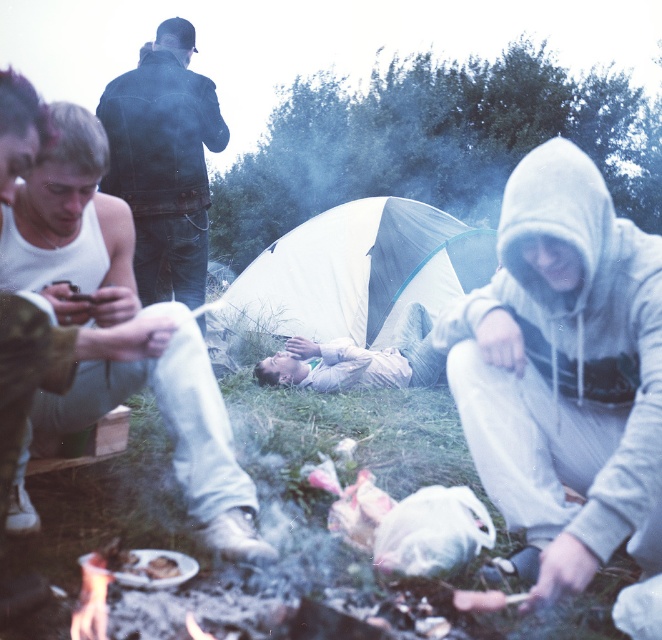
Who is more distant from viewer, (144, 294) or (322, 378)?

Point (322, 378)

Where is `dark blue leather jacket at upper left`? dark blue leather jacket at upper left is located at coordinates (164, 160).

Can you confirm if light gray hoodie at lower right is bigger than white fabric tent at center?

No.

Does point (475, 461) come in front of point (465, 282)?

Yes, it is.

Where is `light gray hoodie at lower right`? light gray hoodie at lower right is located at coordinates click(x=567, y=380).

Who is positioned more to the left, light gray hoodie at lower right or white cotton tank top at left?

Positioned to the left is white cotton tank top at left.

Is light gray hoodie at lower right wider than white cotton tank top at left?

In fact, light gray hoodie at lower right might be narrower than white cotton tank top at left.

Does point (626, 493) come in front of point (99, 129)?

Yes, it is in front of point (99, 129).

Image resolution: width=662 pixels, height=640 pixels. Find the location of `light gray hoodie at lower right`. light gray hoodie at lower right is located at coordinates (567, 380).